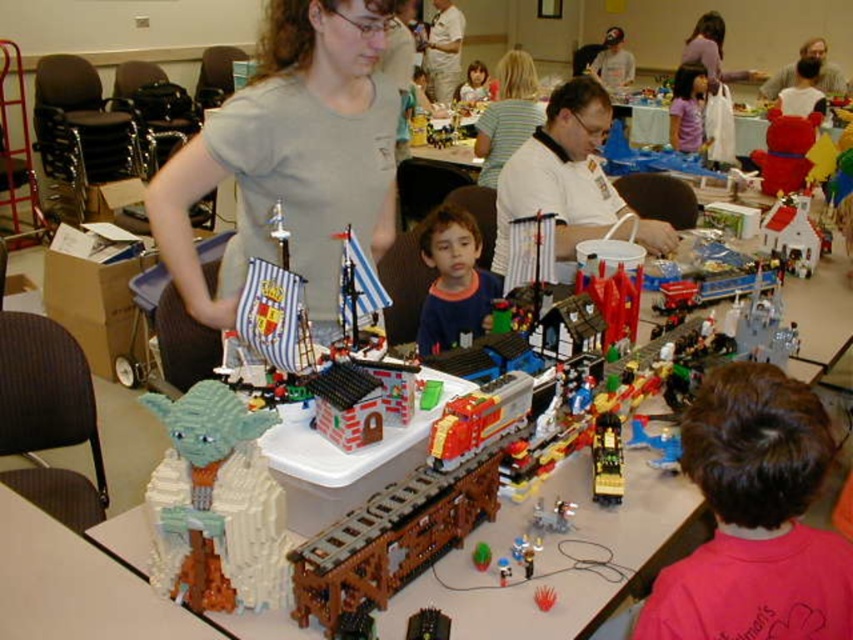
Question: Which of the following is the farthest from the observer?

Choices:
 (A) smooth pink shirt at upper center
 (B) striped fabric shirt at center

Answer: (A)

Question: Which point appears farthest from the camera in this image?

Choices:
 (A) (682, 96)
 (B) (258, 413)
 (C) (486, 173)
 (D) (607, 228)

Answer: (A)

Question: Does brown hair at lower right lie behind light blue plastic yoda at center?

Choices:
 (A) no
 (B) yes

Answer: (A)

Question: Which object is closer to the camera taking this photo?

Choices:
 (A) striped fabric shirt at center
 (B) blue cotton shirt at center
 (C) brown hair at lower right
 (D) smooth pink shirt at upper center

Answer: (C)

Question: Is brown hair at lower right above white matte shirt at center?

Choices:
 (A) no
 (B) yes

Answer: (A)

Question: Can you confirm if gray matte shirt at center is positioned above brown hair at lower right?

Choices:
 (A) no
 (B) yes

Answer: (B)